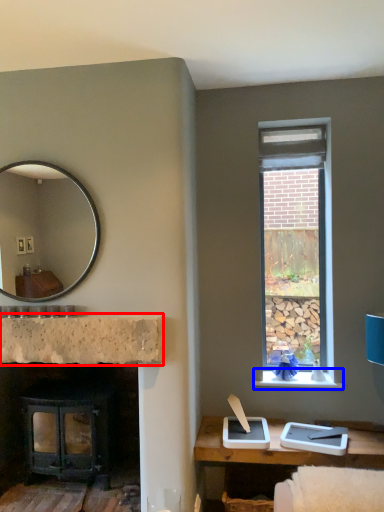
Question: Among these objects, which one is nearest to the camera, counter top (highlighted by a red box) or window sill (highlighted by a blue box)?

Choices:
 (A) counter top
 (B) window sill

Answer: (A)